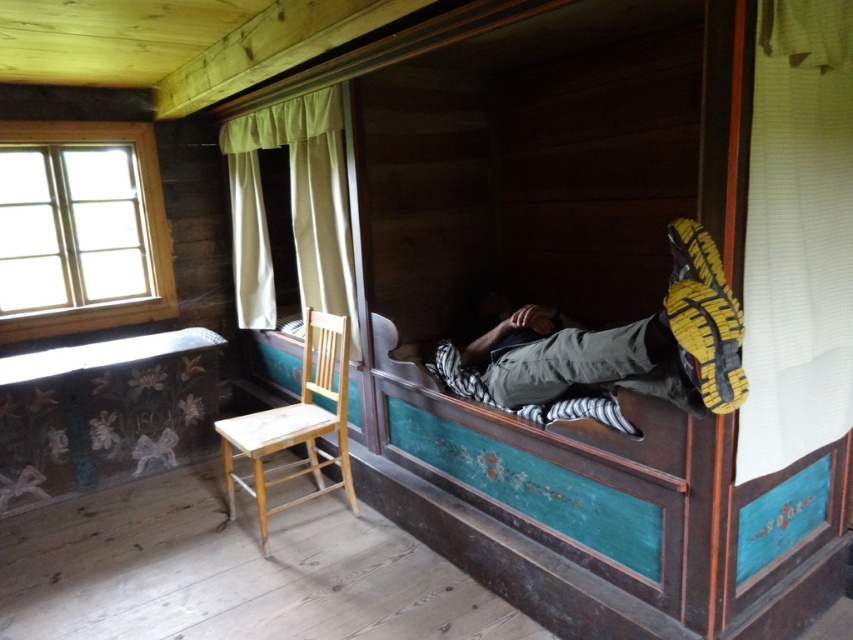
Question: Observing the image, what is the correct spatial positioning of gray fabric pants at center in reference to green fabric curtain at upper center?

Choices:
 (A) above
 (B) below

Answer: (B)

Question: Can you confirm if white textured curtain at upper right is positioned to the right of light brown wooden chair at left?

Choices:
 (A) yes
 (B) no

Answer: (A)

Question: Which point is closer to the camera taking this photo?

Choices:
 (A) (328, 204)
 (B) (556, 376)
 (C) (254, 467)
 (D) (67, 131)

Answer: (B)

Question: Which point is closer to the camera taking this photo?

Choices:
 (A) (320, 148)
 (B) (244, 422)

Answer: (B)

Question: Among these objects, which one is nearest to the camera?

Choices:
 (A) clear glass window at upper left
 (B) white textured curtain at upper right

Answer: (B)

Question: Is white textured curtain at upper right below clear glass window at upper left?

Choices:
 (A) yes
 (B) no

Answer: (A)